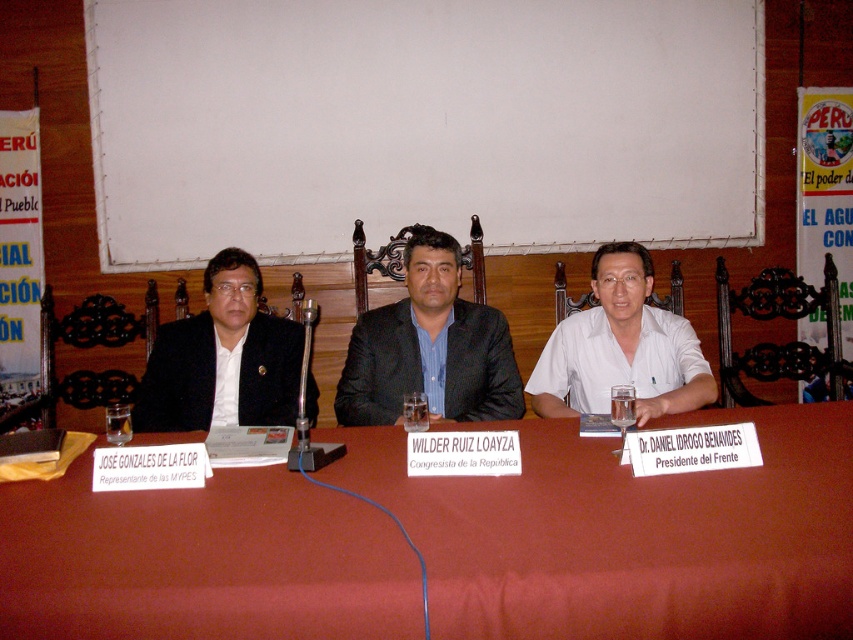
Question: Which of these objects is positioned closest to the clear glass wine glass at center?

Choices:
 (A) smooth red table at center
 (B) white paper at upper center
 (C) black matte suit at center

Answer: (A)

Question: Can you confirm if smooth red table at center is thinner than white cotton shirt at center?

Choices:
 (A) no
 (B) yes

Answer: (A)

Question: Does black matte suit at center have a smaller size compared to clear glass wine glass at center?

Choices:
 (A) no
 (B) yes

Answer: (A)

Question: Which of the following is the closest to the observer?

Choices:
 (A) (757, 141)
 (B) (175, 499)
 (C) (614, 397)
 (D) (683, 339)

Answer: (B)

Question: Which point is farther to the camera?

Choices:
 (A) (399, 387)
 (B) (697, 406)
 (C) (643, 611)
 (D) (625, 429)

Answer: (A)

Question: Does white paper at upper center appear on the right side of smooth red table at center?

Choices:
 (A) yes
 (B) no

Answer: (B)